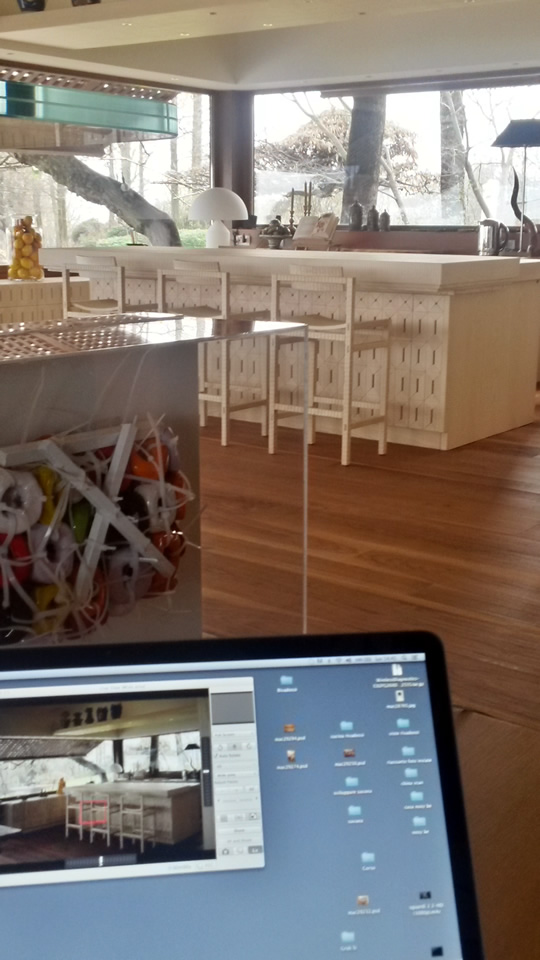
Where is `windows`? windows is located at coordinates (451, 190), (185, 162).